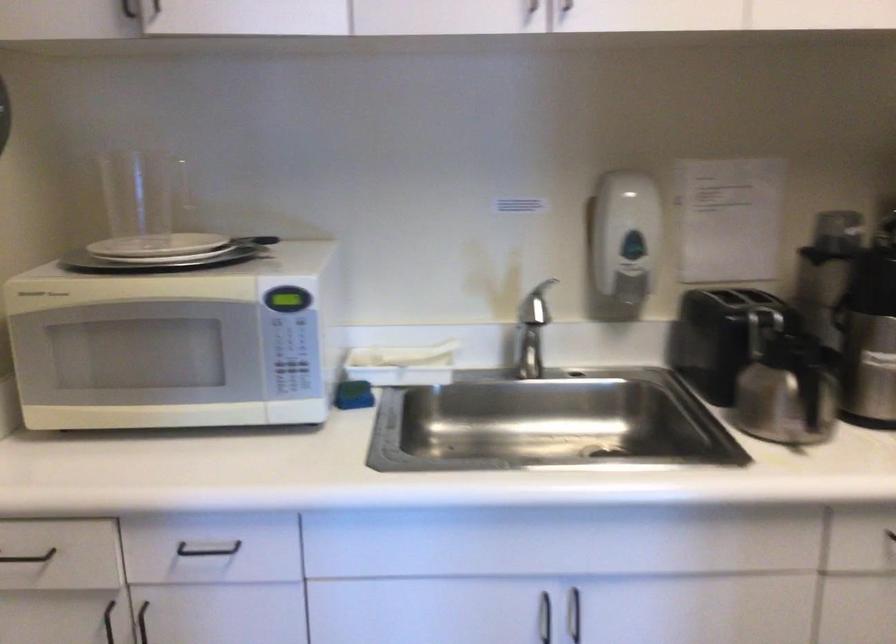
Where would you lift the coffee carafe handle? Please return your answer as a coordinate pair (x, y).

(810, 395)